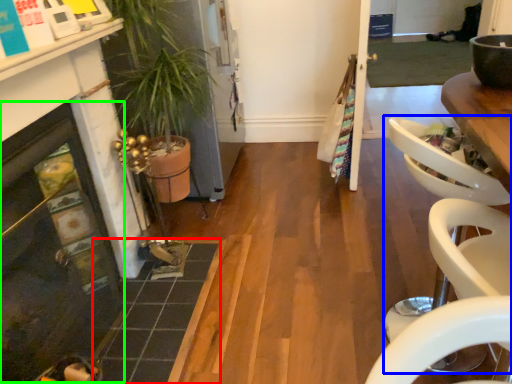
Question: Based on their relative distances, which object is farther from tile (highlighted by a red box)? Choose from armchair (highlighted by a blue box) and fireplace (highlighted by a green box).

Choices:
 (A) armchair
 (B) fireplace

Answer: (A)